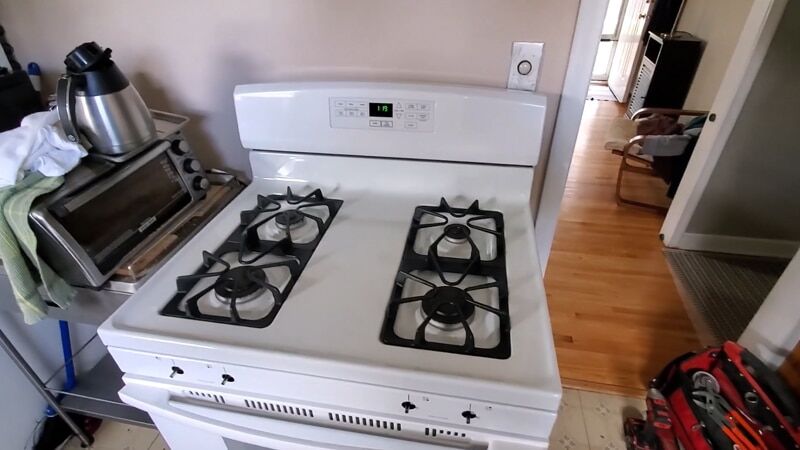
This screenshot has width=800, height=450. I want to click on stove, so click(333, 311).